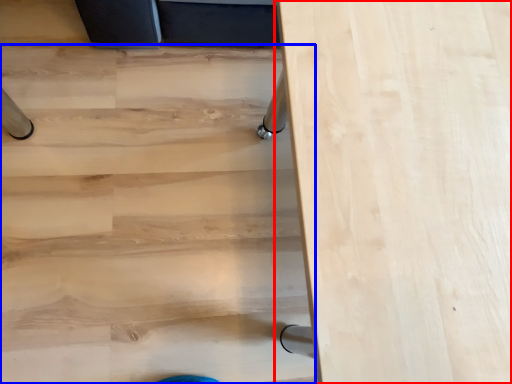
Question: Which point is further to the camera, table (highlighted by a red box) or stairwell (highlighted by a blue box)?

Choices:
 (A) table
 (B) stairwell

Answer: (B)